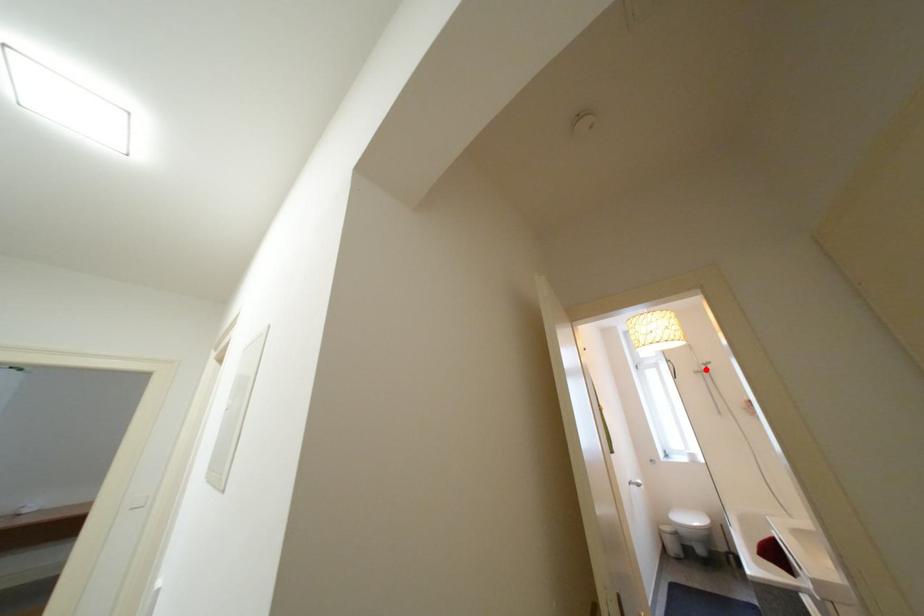
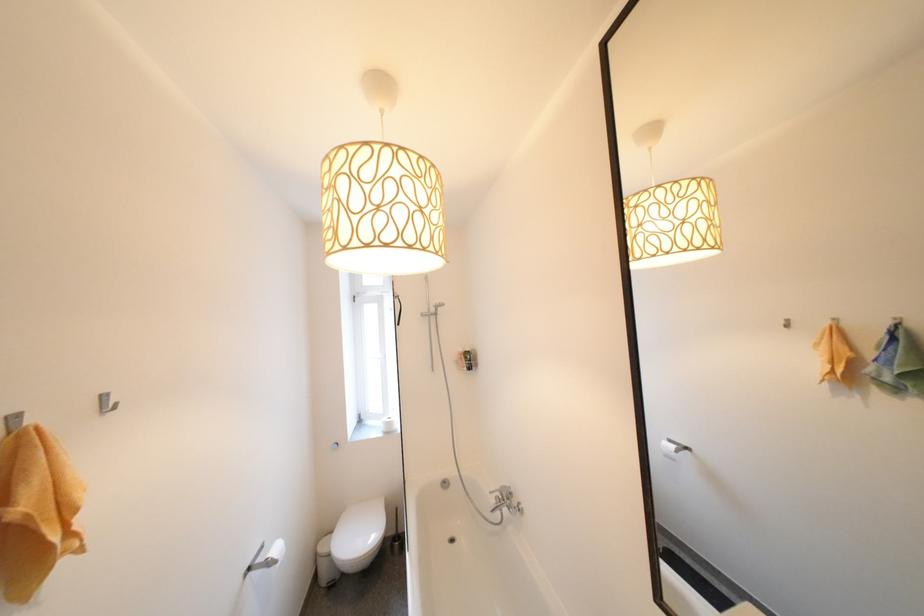
Where in the second image is the point corresponding to the highlighted location from the first image?

(434, 312)